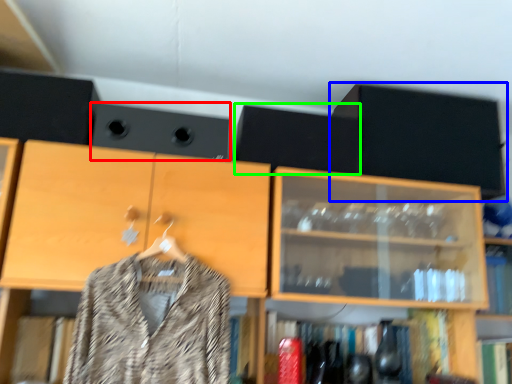
Question: Which object is positioned farthest from speaker (highlighted by a red box)? Select from cabinetry (highlighted by a blue box) and speaker (highlighted by a green box).

Choices:
 (A) cabinetry
 (B) speaker

Answer: (A)